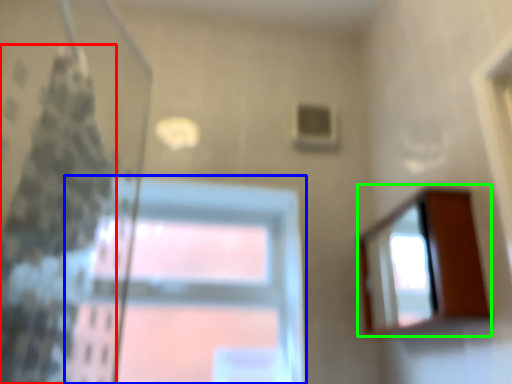
Question: Which is nearer to the shower curtain (highlighted by a red box)? window (highlighted by a blue box) or mirror (highlighted by a green box).

Choices:
 (A) window
 (B) mirror

Answer: (A)